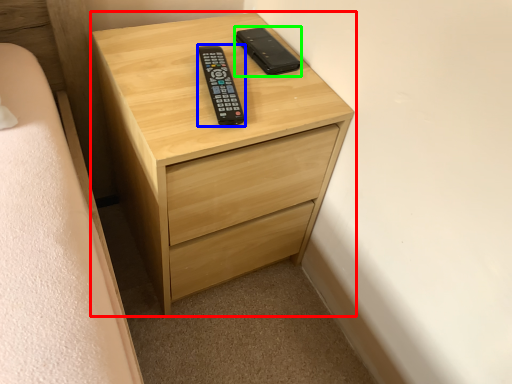
Question: Which is nearer to the chest of drawers (highlighted by a red box)? control (highlighted by a blue box) or control (highlighted by a green box).

Choices:
 (A) control
 (B) control

Answer: (A)